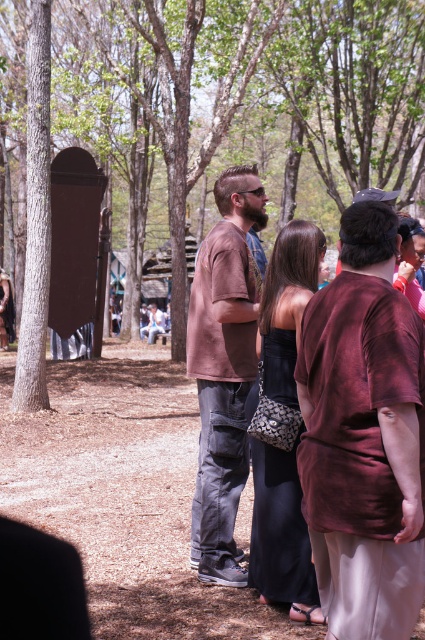
You are standing at the point with coordinates point (357, 90). What is the nearest object to you?

The nearest object to you at point (357, 90) is the brown bark tree at center, as the point is located on it.

You are planning to take a photo of the brown bark tree at center and the brown cotton shirt at center. Which object should you focus on first if you want to capture both in the same frame without moving the camera?

You should focus on the brown cotton shirt at center first because it is closer to the camera than the brown bark tree at center, allowing both to be in focus simultaneously.

You are planning to place a new bench in the park so that it is equidistant from both the brown bark tree at center and the brown cotton shirt at center. Given that the minimum distance required between the bench and each object is 5 meters, is this possible? Please explain.

The brown bark tree at center and brown cotton shirt at center are 15.35 meters apart. To place a bench equidistant from both, it must be placed along the perpendicular bisector of the line connecting them. The midpoint between them is 7.675 meters from each. Since the minimum required distance is 5 meters, placing the bench at the midpoint satisfies this requirement. Therefore, it is possible.